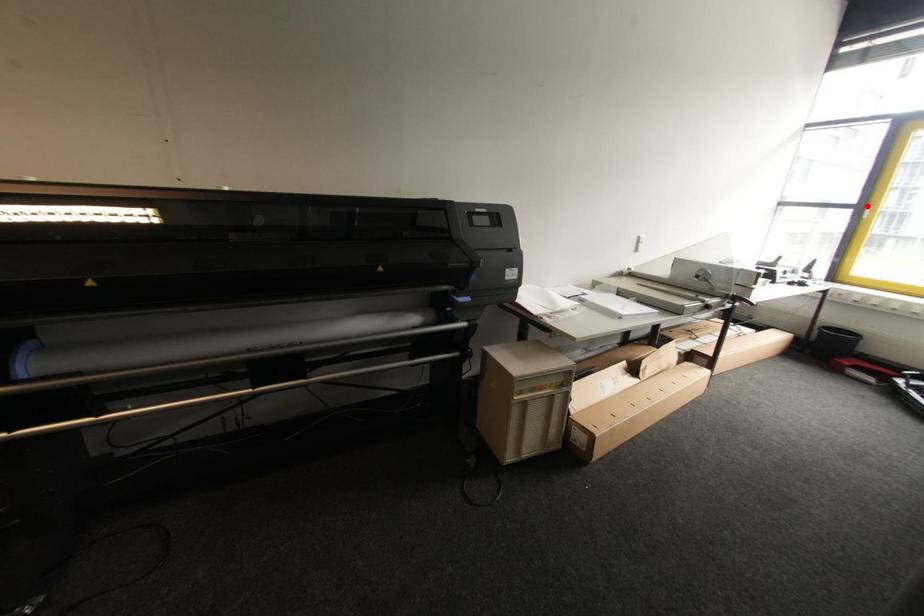
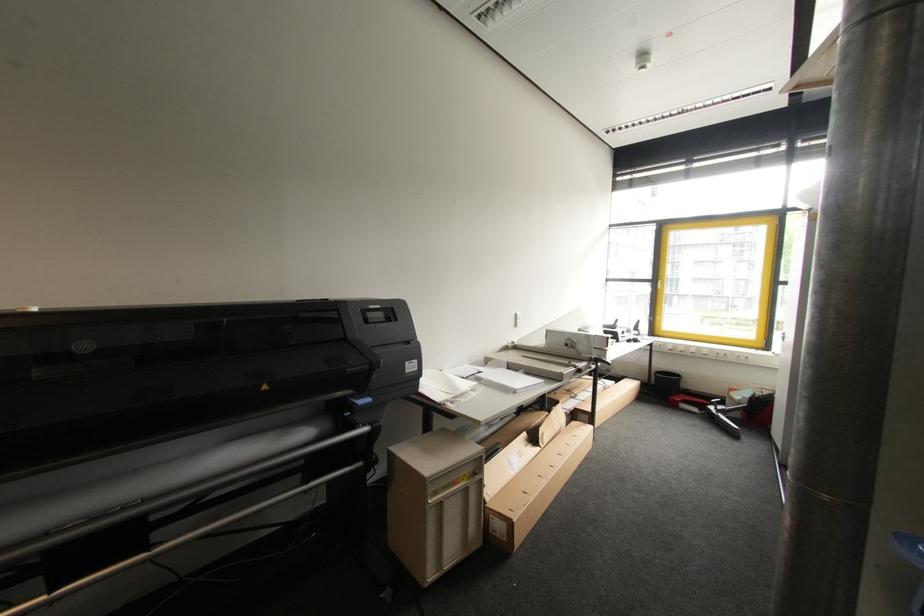
The point at the highlighted location is marked in the first image. Where is the corresponding point in the second image?

(660, 281)